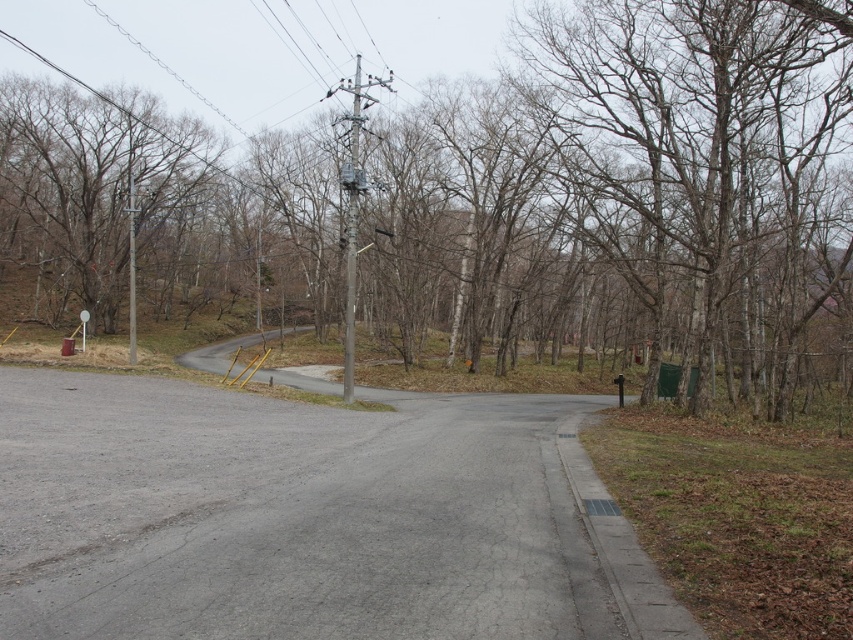
You are standing at the starting point of the road and want to place a new traffic light exactly where the gray concrete pole at center is located. What are the coordinates of the location where you should place the traffic light?

The coordinates for the gray concrete pole at center are at point (351,221).

You are standing on the rural road depicted in the scene. You see a point marked at coordinates (492, 196). What object is located at this point?

The point at coordinates (492, 196) corresponds to the brown leafless tree at center.

Looking at this image, you are driving along the rural road and see the gray concrete pole at center and the metallic gray pole at upper left. Which pole would appear larger to you in terms of height?

The gray concrete pole at center is taller than the metallic gray pole at upper left, so it would appear larger in height.